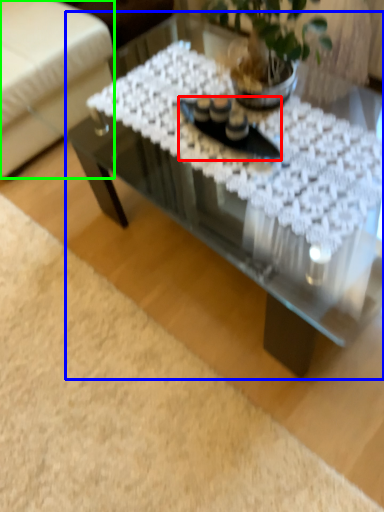
Question: Estimate the real-world distances between objects in this image. Which object is farther from glass plate (highlighted by a red box), coffee table (highlighted by a blue box) or armchair (highlighted by a green box)?

Choices:
 (A) coffee table
 (B) armchair

Answer: (B)